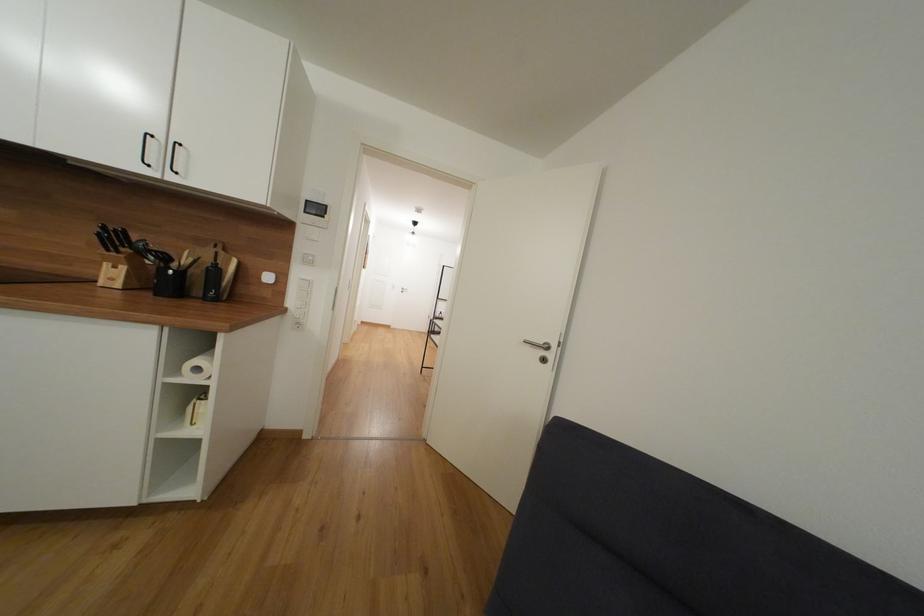
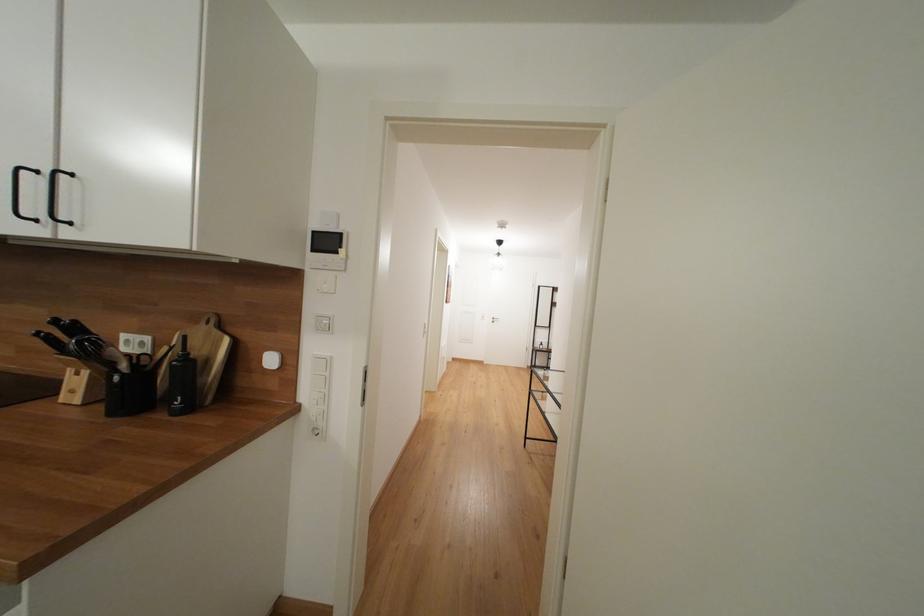
Question: In a continuous first-person perspective shot, in which direction is the camera moving?

Choices:
 (A) Left
 (B) Right
 (C) Forward
 (D) Backward

Answer: (C)